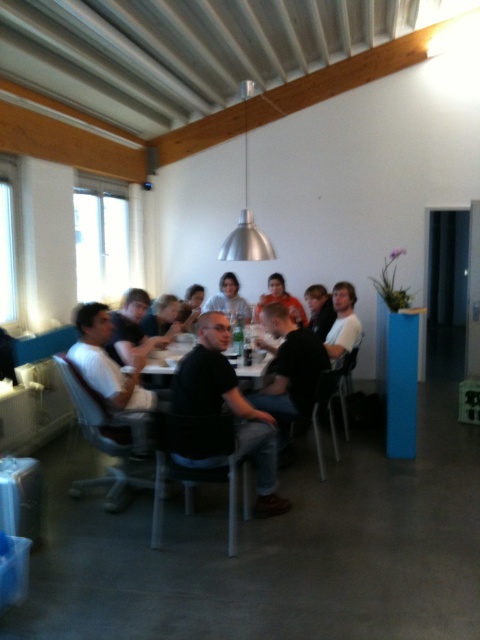
Which of these two, black shirt at center or orange cotton shirt at center, stands shorter?

With less height is orange cotton shirt at center.

Which is more to the right, black shirt at center or orange cotton shirt at center?

From the viewer's perspective, orange cotton shirt at center appears more on the right side.

Does point (262, 500) lie behind point (292, 307)?

No, it is not.

Locate an element on the screen. The height and width of the screenshot is (640, 480). black shirt at center is located at coordinates (255, 392).

Is black fabric chair at center positioned in front of white matte shirt at center?

Yes.

Is black fabric chair at center shorter than white matte shirt at center?

No, black fabric chair at center is not shorter than white matte shirt at center.

Does point (228, 369) lie in front of point (235, 275)?

Yes, point (228, 369) is in front of point (235, 275).

Locate an element on the screen. The height and width of the screenshot is (640, 480). black fabric chair at center is located at coordinates (228, 406).

Measure the distance between point (195, 371) and camera.

Point (195, 371) and camera are 9.76 feet apart.

Describe the element at coordinates (228, 406) in the screenshot. I see `black fabric chair at center` at that location.

The image size is (480, 640). I want to click on black fabric chair at center, so click(x=228, y=406).